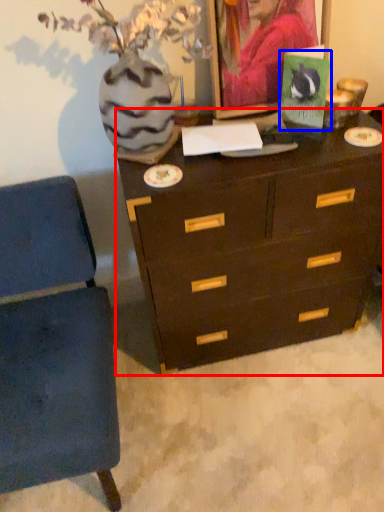
Question: Which object is closer to the camera taking this photo, chest of drawers (highlighted by a red box) or postcard (highlighted by a blue box)?

Choices:
 (A) chest of drawers
 (B) postcard

Answer: (A)